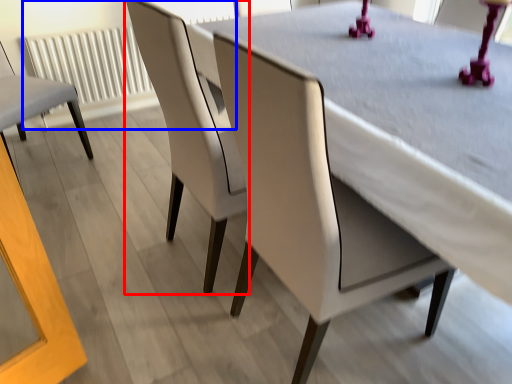
Question: Among these objects, which one is nearest to the camera, chair (highlighted by a red box) or radiator (highlighted by a blue box)?

Choices:
 (A) chair
 (B) radiator

Answer: (A)